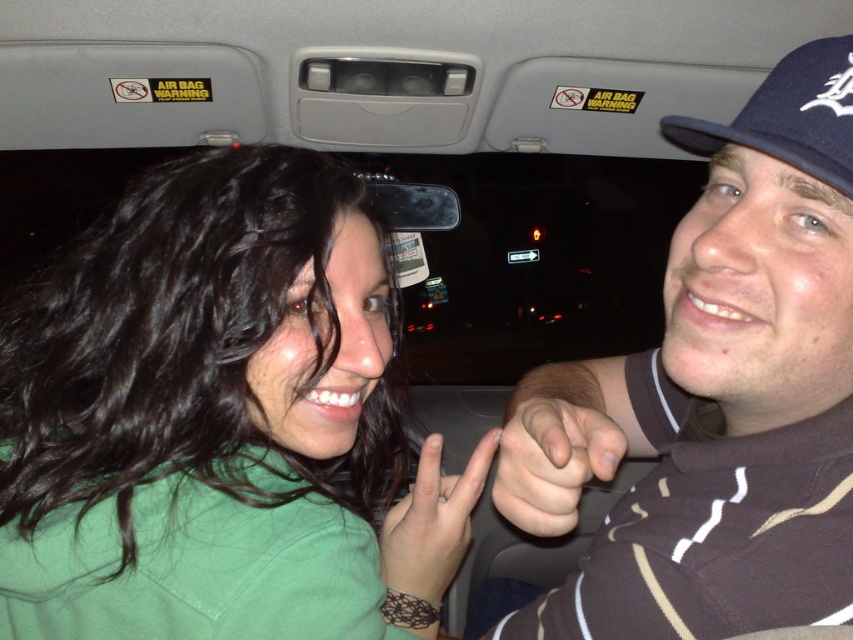
Who is higher up, green matte shirt at upper left or blue fabric baseball cap at upper right?

Positioned higher is blue fabric baseball cap at upper right.

Does green matte shirt at upper left lie behind blue fabric baseball cap at upper right?

Yes, green matte shirt at upper left is further from the viewer.

Is point (126, 429) more distant than point (734, 140)?

Yes, point (126, 429) is behind point (734, 140).

The width and height of the screenshot is (853, 640). What are the coordinates of `green matte shirt at upper left` in the screenshot? It's located at (219, 422).

Locate an element on the screen. This screenshot has width=853, height=640. green matte shirt at upper left is located at coordinates (219, 422).

Who is more forward, (244, 189) or (403, 560)?

Point (244, 189) is in front.

This screenshot has width=853, height=640. What are the coordinates of `green matte shirt at upper left` in the screenshot? It's located at pos(219,422).

Is brown striped shirt at right closer to camera compared to blue fabric baseball cap at upper right?

Yes, it is.

Does brown striped shirt at right have a smaller size compared to blue fabric baseball cap at upper right?

No, brown striped shirt at right is not smaller than blue fabric baseball cap at upper right.

Which is in front, point (839, 152) or point (787, 77)?

Point (839, 152) is in front.

The height and width of the screenshot is (640, 853). I want to click on brown striped shirt at right, so click(717, 396).